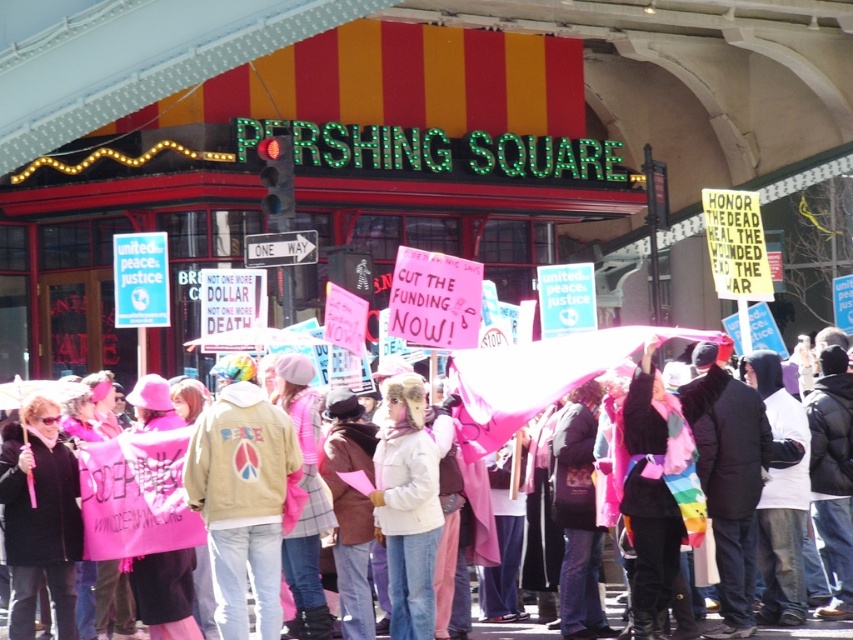
Can you confirm if white fuzzy hat at center is wider than pink fabric scarf at center?

Incorrect, white fuzzy hat at center's width does not surpass pink fabric scarf at center's.

Locate an element on the screen. The image size is (853, 640). white fuzzy hat at center is located at coordinates (407, 506).

Which of these two, tan leather jacket at center or white fuzzy hat at center, stands shorter?

Standing shorter between the two is white fuzzy hat at center.

Is tan leather jacket at center bigger than white fuzzy hat at center?

Yes, tan leather jacket at center is bigger than white fuzzy hat at center.

Measure the distance between tan leather jacket at center and camera.

tan leather jacket at center and camera are 43.40 meters apart from each other.

Image resolution: width=853 pixels, height=640 pixels. In order to click on tan leather jacket at center in this screenshot , I will do `click(242, 496)`.

Does tan leather jacket at center come in front of pink fabric scarf at center?

Yes.

Who is positioned more to the left, tan leather jacket at center or pink fabric scarf at center?

tan leather jacket at center

Is point (222, 412) behind point (544, 358)?

No, (222, 412) is closer to viewer.

What are the coordinates of `tan leather jacket at center` in the screenshot? It's located at (242, 496).